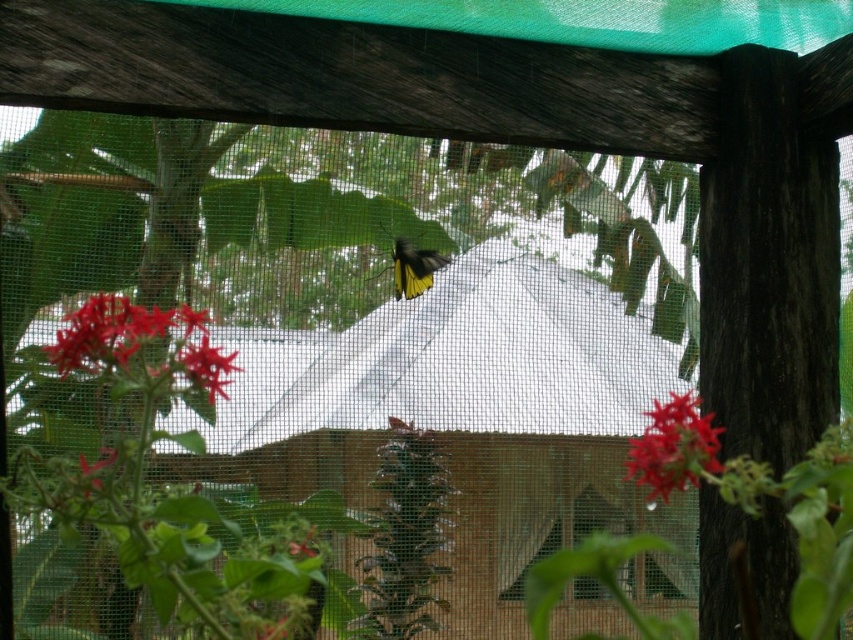
You are an entomologist observing a butterfly through a mesh screen. You notice the yellow matte butterfly at center and the vivid red petals at lower left. Which object is positioned lower in the image?

The vivid red petals at lower left is positioned below the yellow matte butterfly at center, so it is lower in the image.

You are a gardener looking at the image through the mesh screen. You see the vivid red petals at lower left and the smooth glossy red flower at center. Which one is positioned more to the left side of the frame?

The vivid red petals at lower left are positioned more to the left side of the frame compared to the smooth glossy red flower at center.

You are an artist painting this scene. You need to decide which object to paint first based on their sizes. Which one should you start with, the smooth glossy red flower at center or the yellow matte butterfly at center?

The smooth glossy red flower at center occupies less space than the yellow matte butterfly at center, so you should paint the yellow matte butterfly at center first since it takes up more space in the composition.